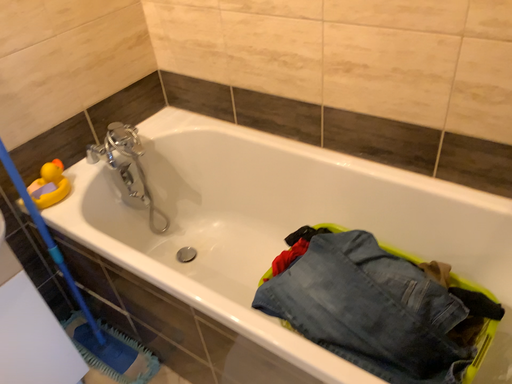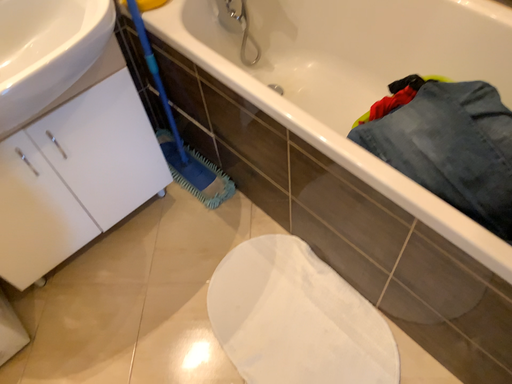
Question: How did the camera likely rotate when shooting the video?

Choices:
 (A) rotated downward
 (B) rotated upward

Answer: (A)